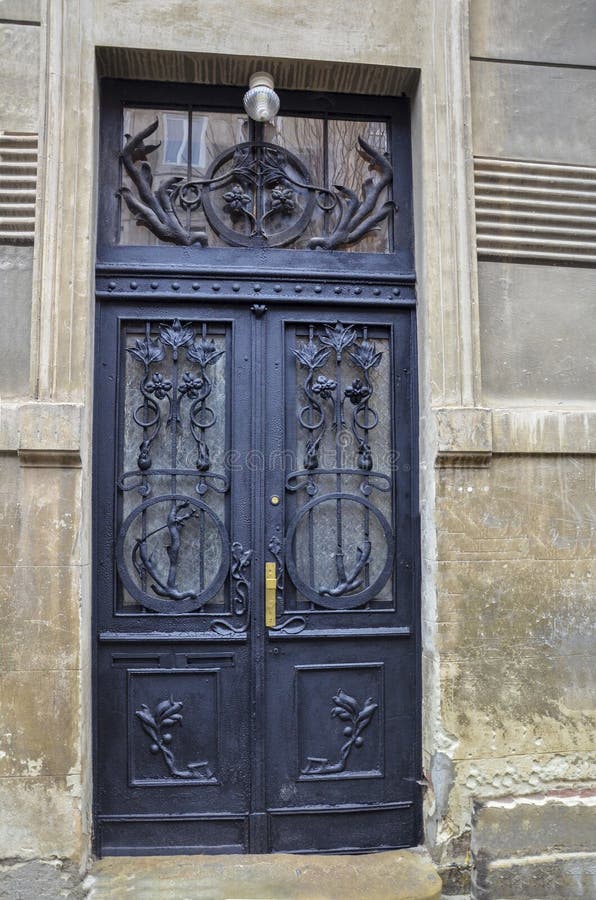
At what (x,y) coordinates should I click in order to perform the action: click on door. Please return your answer as a coordinate pair (x, y). Image resolution: width=596 pixels, height=900 pixels. Looking at the image, I should click on 306,633, 224,637.